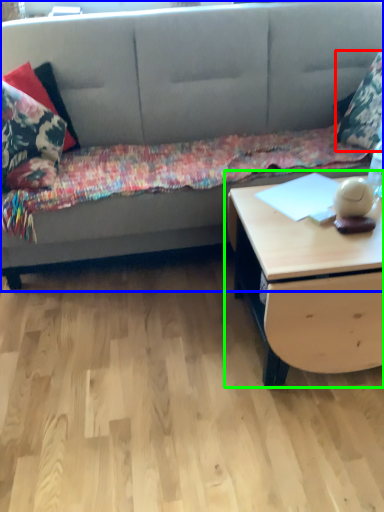
Question: Which object is the farthest from pillow (highlighted by a red box)? Choose among these: studio couch (highlighted by a blue box) or table (highlighted by a green box).

Choices:
 (A) studio couch
 (B) table

Answer: (B)